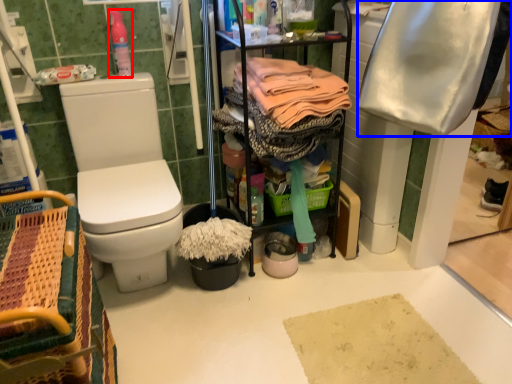
Question: Which of the following is the closest to the observer, cleaning products (highlighted by a red box) or clothing (highlighted by a blue box)?

Choices:
 (A) cleaning products
 (B) clothing

Answer: (B)